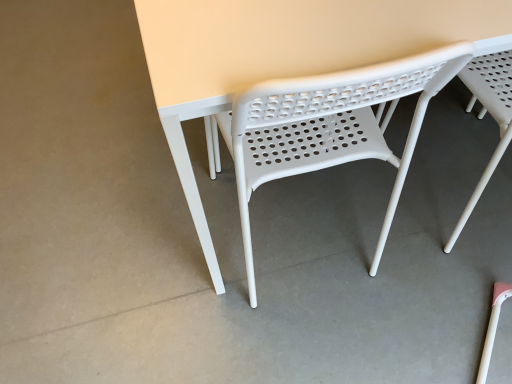
Where is `free space on the front side of white plastic chair at center`? Image resolution: width=512 pixels, height=384 pixels. free space on the front side of white plastic chair at center is located at coordinates (305, 337).